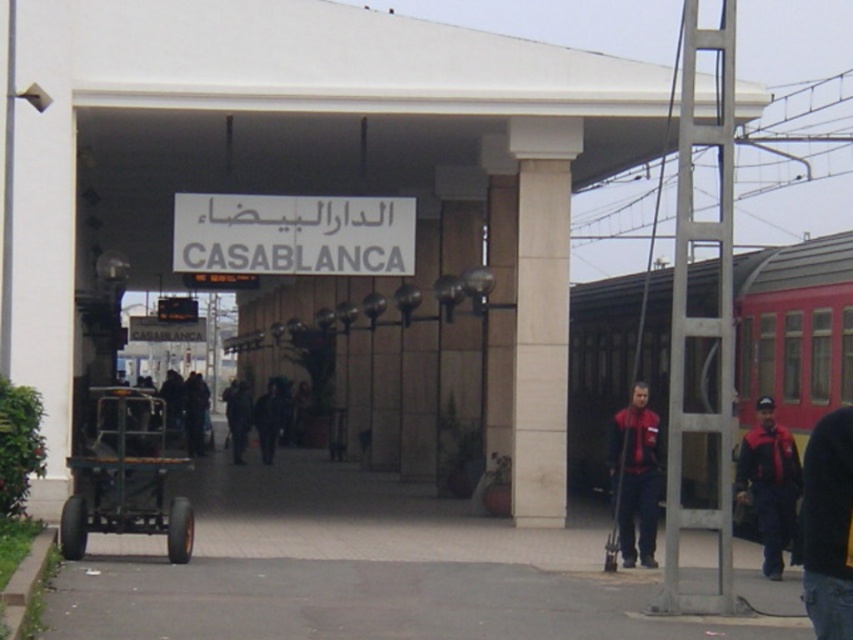
You are standing at the entrance of the Casablanca train station and want to find the metallic black cart at left. According to the station layout, where should you look relative to the entrance?

The metallic black cart at left is located at coordinates point (126, 477) relative to the entrance, which is to the left side near the front area.

You are standing at the entrance of the Casablanca train station. You see a metallic black cart at left and a dark fabric jacket at center. Which object is positioned more to the left side?

The metallic black cart at left is positioned more to the left side than the dark fabric jacket at center.

You are standing at the entrance of the Casablanca train station and see two points marked on the wall. The first point is at coordinate point (107, 518) and the second is at coordinate point (764, 509). Which point is closer to you?

Point (107, 518) is closer to the viewer than point (764, 509).